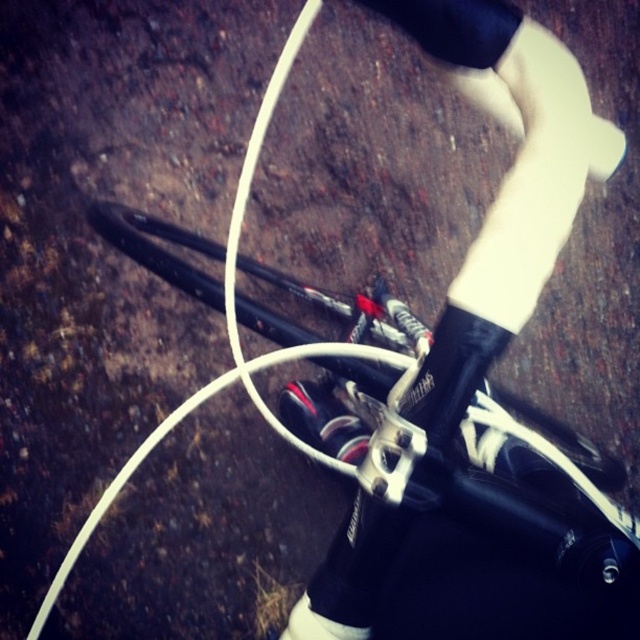
Question: Which point appears farthest from the camera in this image?

Choices:
 (A) (333, 388)
 (B) (337, 637)

Answer: (A)

Question: Which point is closer to the camera?

Choices:
 (A) (332, 637)
 (B) (348, 410)

Answer: (A)

Question: Is shiny black shoe at center wider than white matte shoe at center?

Choices:
 (A) no
 (B) yes

Answer: (B)

Question: Is shiny black shoe at center bigger than white matte shoe at center?

Choices:
 (A) no
 (B) yes

Answer: (B)

Question: Can you confirm if shiny black shoe at center is smaller than white matte shoe at center?

Choices:
 (A) no
 (B) yes

Answer: (A)